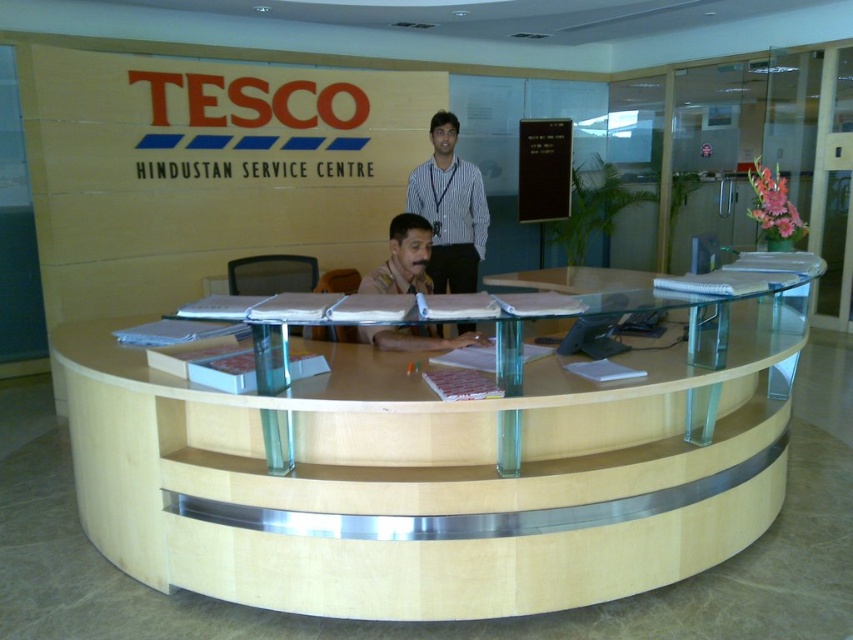
You are a customer entering the Hindustan Service Centre and see the reception area. There are two employees visible at the desk. One is wearing a white striped shirt at upper center and the other has a brown uniform at center. Which employee is positioned more to the right side of the desk?

The white striped shirt at upper center is positioned to the right of the brown uniform at center, so the employee in the white striped shirt at upper center is more to the right side of the desk.